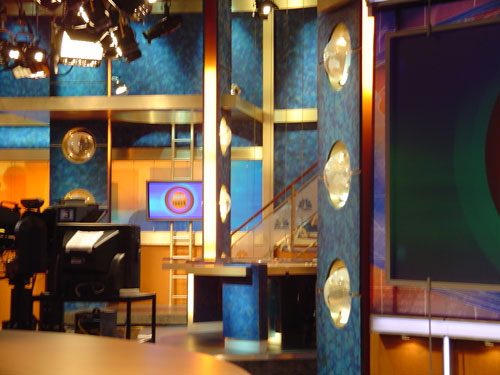
This screenshot has height=375, width=500. What are the coordinates of `spot lights` in the screenshot? It's located at (40, 52), (12, 54), (78, 53), (117, 91).